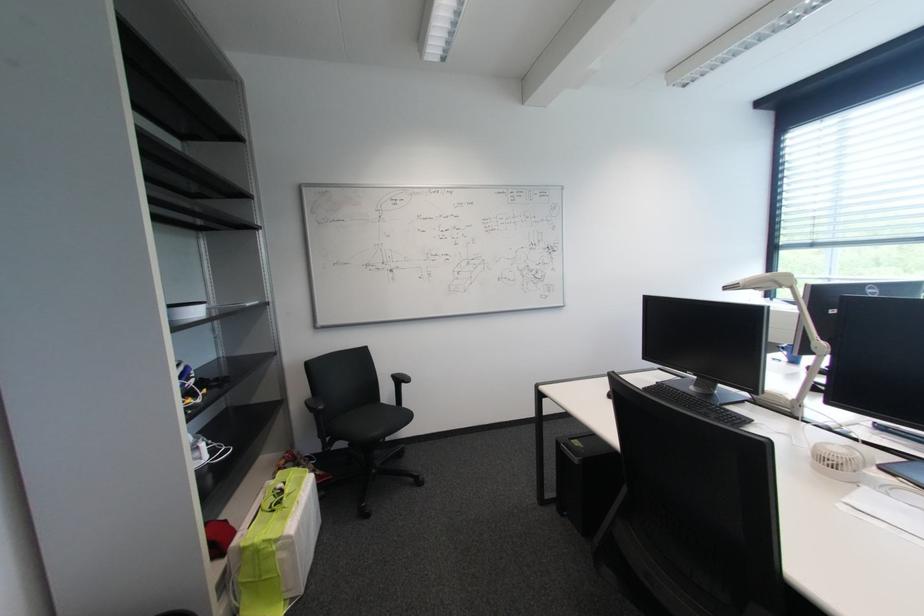
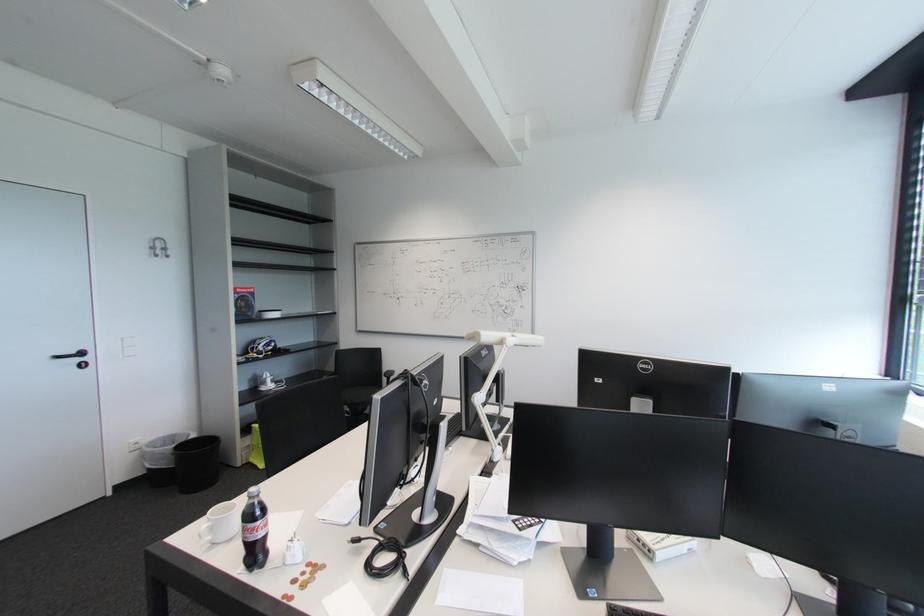
In the second image, find the point that corresponds to [550,299] in the first image.

(517, 331)